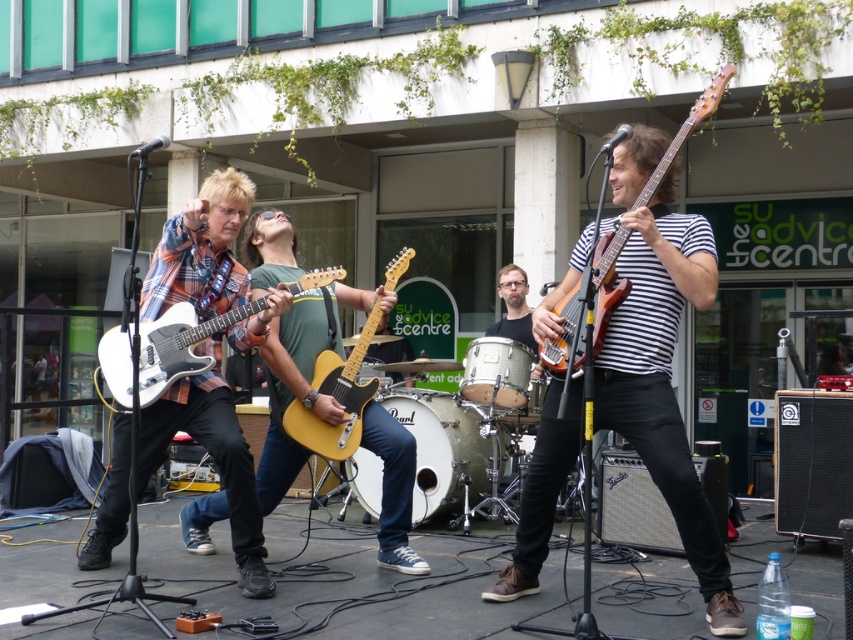
Is matte white guitar at center closer to camera compared to butterscotch wood electric guitar at center?

Yes.

Which is below, matte white guitar at center or butterscotch wood electric guitar at center?

Positioned lower is matte white guitar at center.

Does point (524, 588) lie in front of point (300, 403)?

Yes, it is in front of point (300, 403).

Identify the location of matte white guitar at center. Image resolution: width=853 pixels, height=640 pixels. (635, 353).

At what (x,y) coordinates should I click in order to perform the action: click on matte white guitar at center. Please return your answer as a coordinate pair (x, y). The image size is (853, 640). Looking at the image, I should click on (635, 353).

Locate an element on the screen. The width and height of the screenshot is (853, 640). matte white guitar at center is located at coordinates (635, 353).

Measure the distance between point [213,211] and camera.

Point [213,211] and camera are 17.56 feet apart from each other.

Is plaid fabric shirt at center positioned before matte brown electric guitar at right?

No.

Image resolution: width=853 pixels, height=640 pixels. What are the coordinates of `plaid fabric shirt at center` in the screenshot? It's located at (212, 458).

I want to click on plaid fabric shirt at center, so click(x=212, y=458).